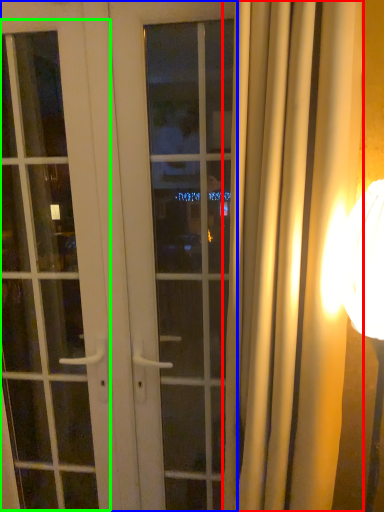
Question: Which object is the closest to the curtain (highlighted by a red box)? Choose among these: door (highlighted by a blue box) or screen door (highlighted by a green box).

Choices:
 (A) door
 (B) screen door

Answer: (A)